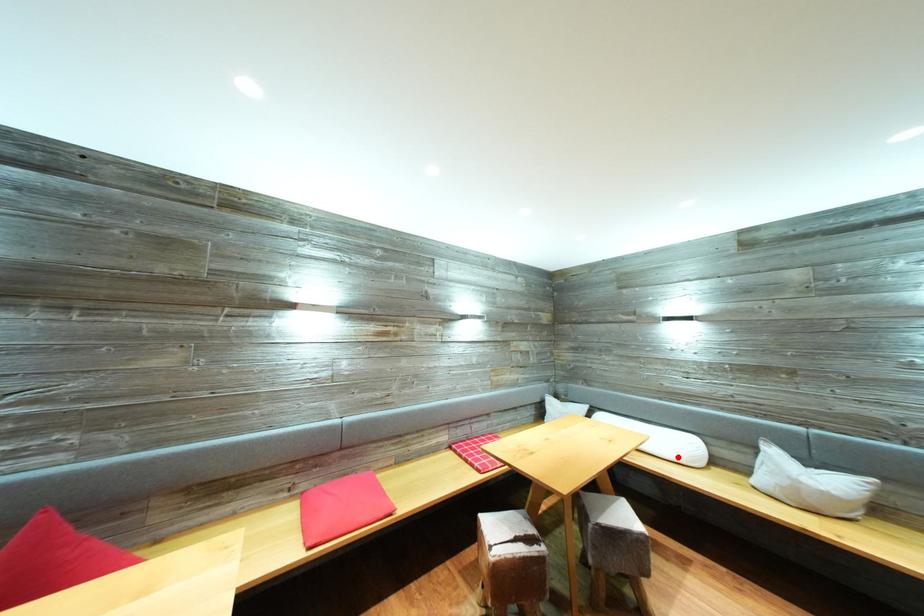
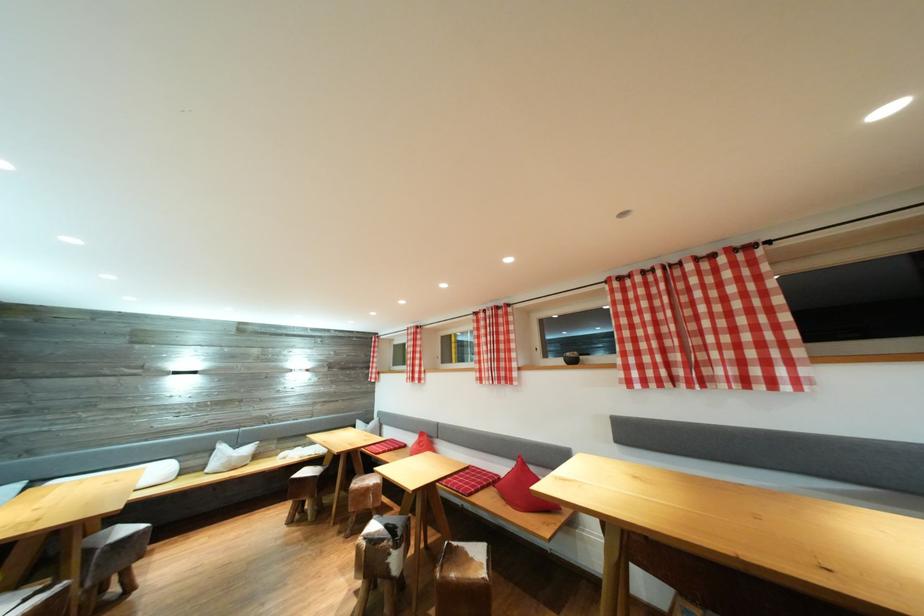
In the second image, find the point that corresponds to the highlighted location in the first image.

(161, 483)